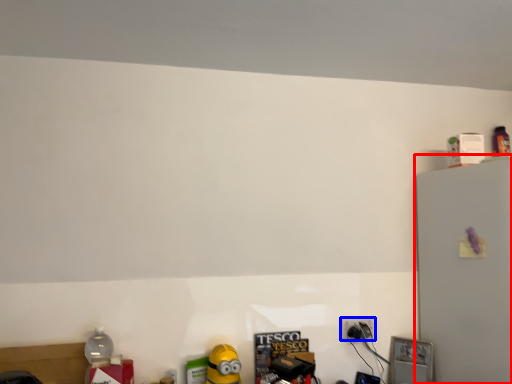
Question: Which object appears farthest to the camera in this image, fridge (highlighted by a red box) or power plugs and sockets (highlighted by a blue box)?

Choices:
 (A) fridge
 (B) power plugs and sockets

Answer: (B)